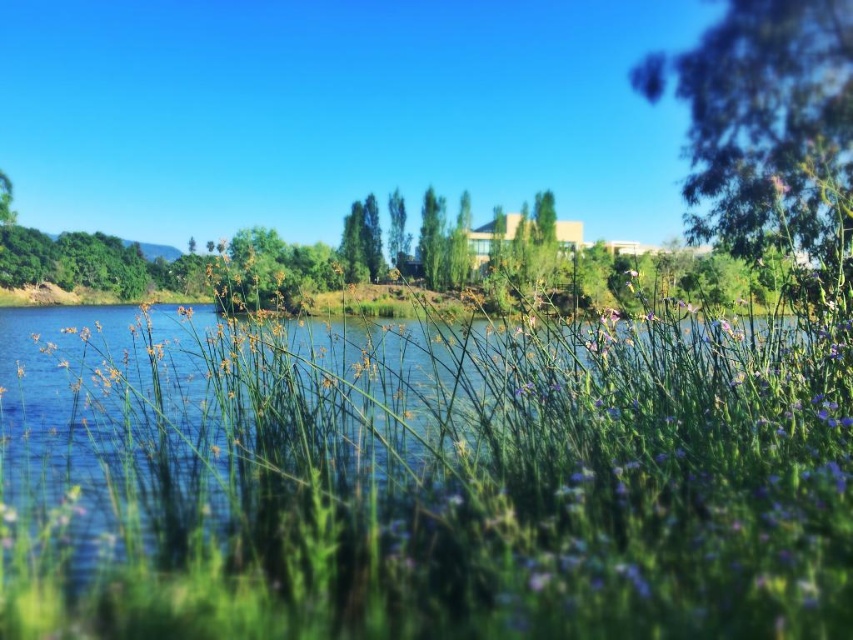
Does point (86, 381) come farther from viewer compared to point (387, 211)?

No, (86, 381) is in front of (387, 211).

Is green grass at center above green leafy tree at center?

No, green grass at center is not above green leafy tree at center.

Measure the distance between point (641, 528) and camera.

Point (641, 528) and camera are 4.66 meters apart from each other.

I want to click on green grass at center, so click(424, 476).

Does green grass at center have a lesser width compared to green leafy tree at upper right?

Yes.

Find the location of a particular element. green grass at center is located at coordinates (424, 476).

Does green leafy tree at upper right have a greater height compared to green leafy tree at center?

Correct, green leafy tree at upper right is much taller as green leafy tree at center.

This screenshot has height=640, width=853. I want to click on green leafy tree at upper right, so click(769, 120).